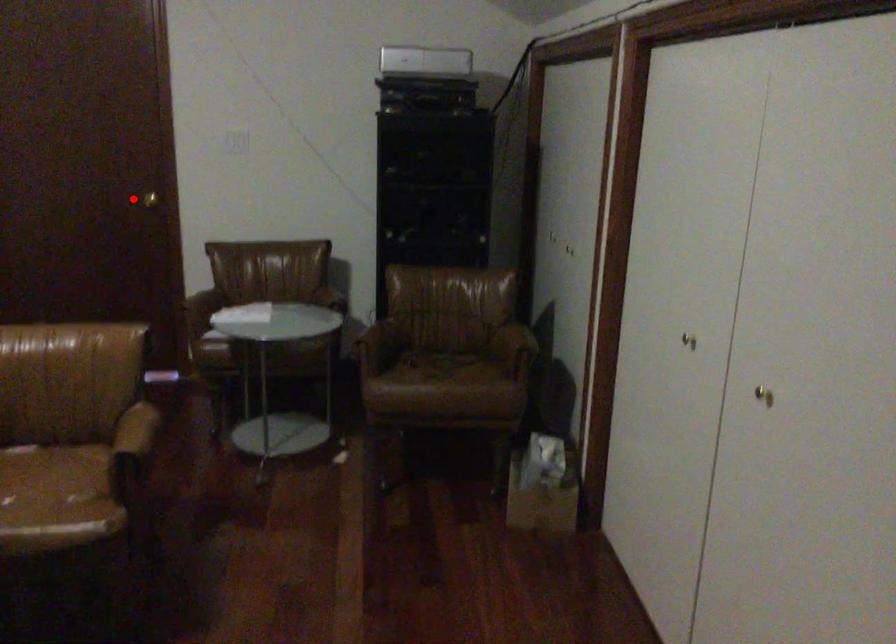
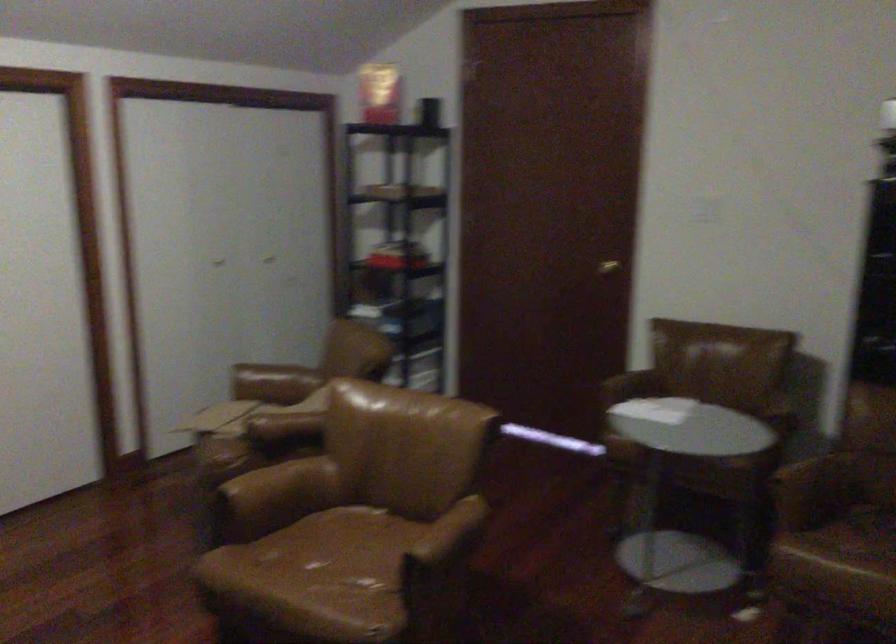
Where in the second image is the point corresponding to the highlighted location from the first image?

(607, 267)